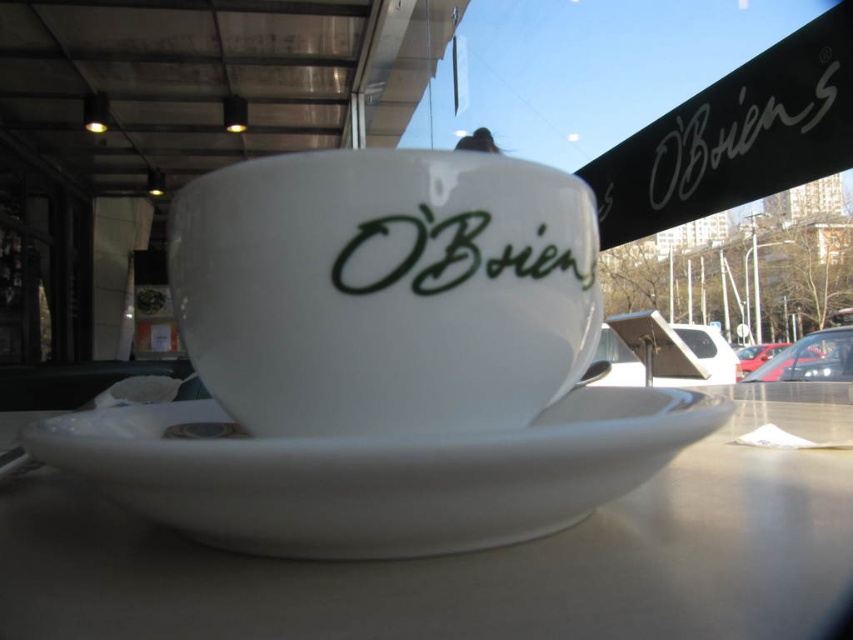
Consider the image. You are a barista at O Brennan s. You need to place a customer s order on the counter. The customer ordered a latte in a cup that s exactly 8 inches tall. You have a white porcelain cup at center that s 8.5 inches tall. Can the cup be used for the order?

The white porcelain cup at center is 8.5 inches tall, which is taller than the required 8 inches. Therefore, the cup can be used for the order as it meets the height requirement.

You are a barista at O Brien s and you need to place a small sugar cube between the white porcelain cup at center and the green matte text at center. Can the sugar cube fit in the space between them?

The distance between the white porcelain cup at center and the green matte text at center is 1.09 inches. A standard sugar cube measures approximately 0.75 inches in each dimension, so it can fit in the space between them.

You are a customer entering the cafe and want to read both the white matte signboard at upper center and the green matte text at center. Which one can you read more clearly from your current position?

The white matte signboard at upper center can be read more clearly because it is closer to you than the green matte text at center, which is farther away.